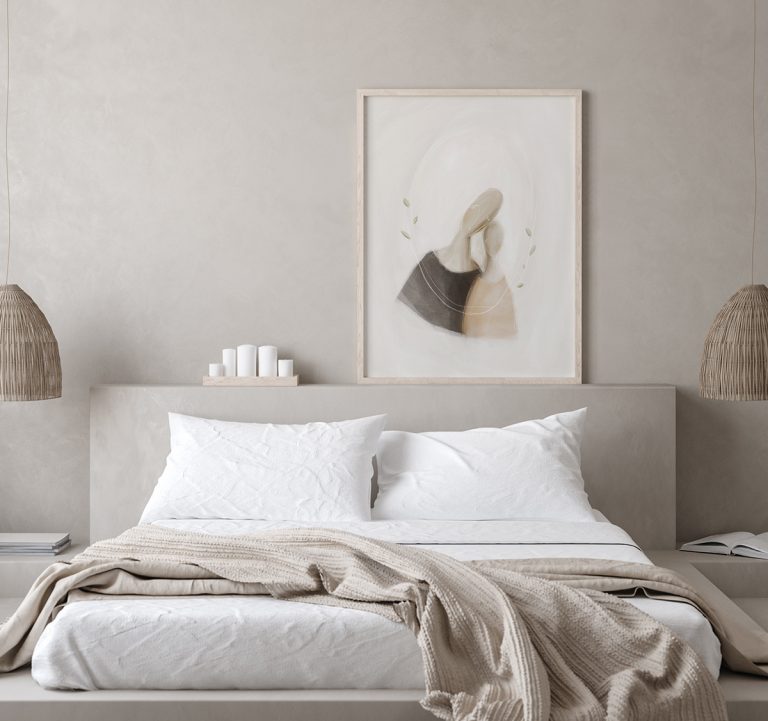
The height and width of the screenshot is (721, 768). Identify the location of mattress. (250, 640).